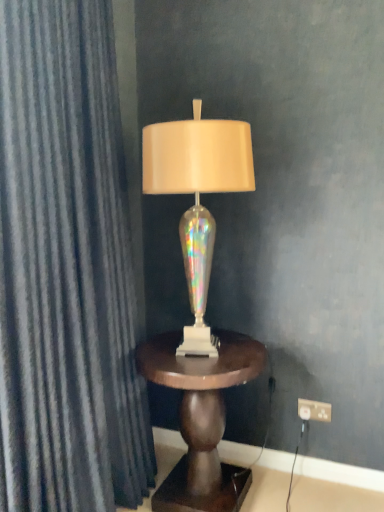
Image resolution: width=384 pixels, height=512 pixels. What do you see at coordinates (314, 410) in the screenshot? I see `white plastic outlet at lower right` at bounding box center [314, 410].

What are the coordinates of `dark blue textured curtain at left` in the screenshot? It's located at pyautogui.click(x=66, y=269).

In terms of height, does mahogany wood side table at center look taller or shorter compared to white plastic outlet at lower right?

In the image, mahogany wood side table at center appears to be taller than white plastic outlet at lower right.

Can you confirm if mahogany wood side table at center is positioned to the right of white plastic outlet at lower right?

No.

Does point (144, 345) come farther from viewer compared to point (329, 414)?

No, it is in front of (329, 414).

From the image's perspective, between mahogany wood side table at center and white plastic outlet at lower right, which one is located above?

white plastic outlet at lower right.

Does iridescent glass lamp at center appear on the left side of dark blue textured curtain at left?

Incorrect, iridescent glass lamp at center is not on the left side of dark blue textured curtain at left.

From the image's perspective, which one is positioned lower, iridescent glass lamp at center or dark blue textured curtain at left?

dark blue textured curtain at left appears lower in the image.

You are a GUI agent. You are given a task and a screenshot of the screen. Output one action in this format:
    pyautogui.click(x=<x>, y=<y>)
    Task: Click on the lamp above the dark blue textured curtain at left (from the image's perspective)
    
    Given the screenshot: What is the action you would take?
    pyautogui.click(x=197, y=196)

Looking at the image, does dark blue textured curtain at left seem bigger or smaller compared to mahogany wood side table at center?

In the image, dark blue textured curtain at left appears to be larger than mahogany wood side table at center.

From the picture: Considering the relative positions of dark blue textured curtain at left and mahogany wood side table at center in the image provided, is dark blue textured curtain at left to the left or to the right of mahogany wood side table at center?

In the image, dark blue textured curtain at left appears on the left side of mahogany wood side table at center.

Which of these two, dark blue textured curtain at left or mahogany wood side table at center, stands shorter?

mahogany wood side table at center is shorter.

Considering the positions of objects white plastic outlet at lower right and iridescent glass lamp at center in the image provided, who is in front, white plastic outlet at lower right or iridescent glass lamp at center?

iridescent glass lamp at center is closer to the camera.

How different are the orientations of white plastic outlet at lower right and iridescent glass lamp at center in degrees?

0.545 degrees separate the facing orientations of white plastic outlet at lower right and iridescent glass lamp at center.

Which object is positioned more to the right, white plastic outlet at lower right or iridescent glass lamp at center?

Positioned to the right is white plastic outlet at lower right.

How far apart are white plastic outlet at lower right and iridescent glass lamp at center?

36.29 inches.

From a real-world perspective, is mahogany wood side table at center on top of dark blue textured curtain at left?

No.

Is point (211, 444) closer or farther from the camera than point (4, 292)?

Point (211, 444) is positioned farther from the camera compared to point (4, 292).

Where is `curtain that is in front of the mahogany wood side table at center`? curtain that is in front of the mahogany wood side table at center is located at coordinates click(66, 269).

In terms of width, does mahogany wood side table at center look wider or thinner when compared to iridescent glass lamp at center?

Considering their sizes, mahogany wood side table at center looks broader than iridescent glass lamp at center.

Which of these two, mahogany wood side table at center or iridescent glass lamp at center, is bigger?

Bigger between the two is mahogany wood side table at center.

Does mahogany wood side table at center have a lesser height compared to iridescent glass lamp at center?

Correct, mahogany wood side table at center is not as tall as iridescent glass lamp at center.

Which is in front, mahogany wood side table at center or iridescent glass lamp at center?

iridescent glass lamp at center.

Which is correct: iridescent glass lamp at center is inside mahogany wood side table at center, or outside of it?

iridescent glass lamp at center cannot be found inside mahogany wood side table at center.

Is iridescent glass lamp at center beside mahogany wood side table at center?

They are not placed beside each other.

Where is `lamp above the mahogany wood side table at center (from a real-world perspective)`? This screenshot has width=384, height=512. lamp above the mahogany wood side table at center (from a real-world perspective) is located at coordinates (197, 196).

Identify the location of electric outlet directly beneath the mahogany wood side table at center (from a real-world perspective). The height and width of the screenshot is (512, 384). (314, 410).

The image size is (384, 512). What are the coordinates of `curtain located below the iridescent glass lamp at center (from the image's perspective)` in the screenshot? It's located at (66, 269).

From the image, which object appears to be farther from white plastic outlet at lower right, iridescent glass lamp at center or mahogany wood side table at center?

Based on the image, iridescent glass lamp at center appears to be further to white plastic outlet at lower right.

Estimate the real-world distances between objects in this image. Which object is further from white plastic outlet at lower right, dark blue textured curtain at left or mahogany wood side table at center?

dark blue textured curtain at left is positioned further to the anchor white plastic outlet at lower right.

From the image, which object appears to be nearer to dark blue textured curtain at left, iridescent glass lamp at center or mahogany wood side table at center?

iridescent glass lamp at center.

When comparing their distances from mahogany wood side table at center, does iridescent glass lamp at center or white plastic outlet at lower right seem further?

white plastic outlet at lower right.

Estimate the real-world distances between objects in this image. Which object is closer to mahogany wood side table at center, white plastic outlet at lower right or iridescent glass lamp at center?

iridescent glass lamp at center is positioned closer to the anchor mahogany wood side table at center.

When comparing their distances from dark blue textured curtain at left, does white plastic outlet at lower right or mahogany wood side table at center seem closer?

mahogany wood side table at center is positioned closer to the anchor dark blue textured curtain at left.

Estimate the real-world distances between objects in this image. Which object is closer to iridescent glass lamp at center, white plastic outlet at lower right or dark blue textured curtain at left?

dark blue textured curtain at left is closer to iridescent glass lamp at center.

Looking at the image, which one is located further to dark blue textured curtain at left, mahogany wood side table at center or iridescent glass lamp at center?

mahogany wood side table at center lies further to dark blue textured curtain at left than the other object.

This screenshot has height=512, width=384. I want to click on electric outlet that lies between iridescent glass lamp at center and mahogany wood side table at center from top to bottom, so click(x=314, y=410).

At what (x,y) coordinates should I click in order to perform the action: click on lamp positioned between dark blue textured curtain at left and white plastic outlet at lower right from near to far. Please return your answer as a coordinate pair (x, y). The height and width of the screenshot is (512, 384). Looking at the image, I should click on (197, 196).

At what (x,y) coordinates should I click in order to perform the action: click on curtain between iridescent glass lamp at center and mahogany wood side table at center in the vertical direction. Please return your answer as a coordinate pair (x, y). The image size is (384, 512). Looking at the image, I should click on pos(66,269).

This screenshot has width=384, height=512. In order to click on table positioned between dark blue textured curtain at left and white plastic outlet at lower right from near to far in this screenshot , I will do `click(202, 417)`.